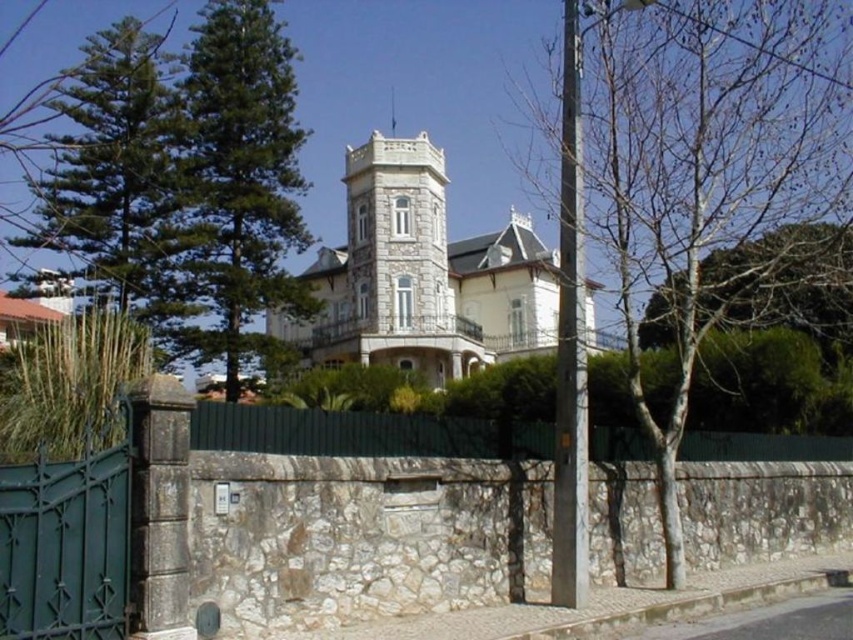
You are a visitor approaching the entrance of the building and see the bare wood tree at center and the green leafy tree at left. Which tree is closer to the entrance?

The bare wood tree at center is closer to the entrance because it is located below the green leafy tree at left, indicating it is positioned in front of it.

You are standing in front of the grand stone building and notice two trees in the scene. Which tree is positioned to the right of the other, the bare wood tree at center or the green leafy tree at left?

The bare wood tree at center is positioned to the right of the green leafy tree at left.

You are a gardener planning to plant a new tree in the yard of the grand stone building. You have two options from the image, the bare wood tree at center and the green leafy tree at left. Which tree has a smaller trunk diameter?

The bare wood tree at center is thinner than the green leafy tree at left, so it has a smaller trunk diameter.